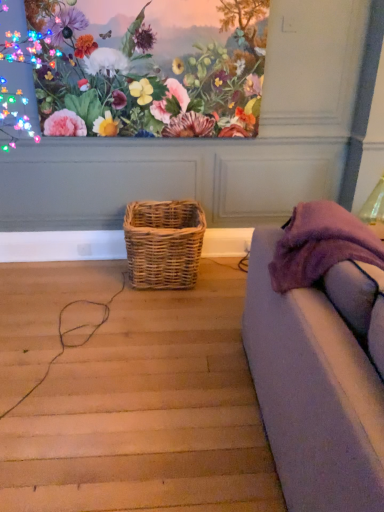
Question: From a real-world perspective, does purple fabric couch at right sit lower than matte floral painting at upper center?

Choices:
 (A) yes
 (B) no

Answer: (A)

Question: Is matte floral painting at upper center surrounded by purple fabric couch at right?

Choices:
 (A) yes
 (B) no

Answer: (B)

Question: Is purple fabric couch at right bigger than matte floral painting at upper center?

Choices:
 (A) yes
 (B) no

Answer: (A)

Question: Does purple fabric couch at right come in front of matte floral painting at upper center?

Choices:
 (A) yes
 (B) no

Answer: (A)

Question: Is purple fabric couch at right turned away from matte floral painting at upper center?

Choices:
 (A) no
 (B) yes

Answer: (A)

Question: Is matte floral painting at upper center taller or shorter than woven natural basket at center?

Choices:
 (A) short
 (B) tall

Answer: (B)

Question: In terms of size, does matte floral painting at upper center appear bigger or smaller than woven natural basket at center?

Choices:
 (A) big
 (B) small

Answer: (B)

Question: Is point (221, 96) closer or farther from the camera than point (178, 287)?

Choices:
 (A) closer
 (B) farther

Answer: (A)

Question: Do you think matte floral painting at upper center is within woven natural basket at center, or outside of it?

Choices:
 (A) inside
 (B) outside

Answer: (B)

Question: From the image's perspective, relative to woven natural basket at center, is purple fabric couch at right above or below?

Choices:
 (A) below
 (B) above

Answer: (A)

Question: In terms of height, does purple fabric couch at right look taller or shorter compared to woven natural basket at center?

Choices:
 (A) tall
 (B) short

Answer: (A)

Question: Considering their positions, is purple fabric couch at right located in front of or behind woven natural basket at center?

Choices:
 (A) front
 (B) behind

Answer: (A)

Question: Considering the positions of purple fabric couch at right and woven natural basket at center in the image, is purple fabric couch at right wider or thinner than woven natural basket at center?

Choices:
 (A) thin
 (B) wide

Answer: (B)

Question: Is woven natural basket at center to the left or to the right of matte floral painting at upper center in the image?

Choices:
 (A) left
 (B) right

Answer: (B)

Question: From their relative heights in the image, would you say woven natural basket at center is taller or shorter than matte floral painting at upper center?

Choices:
 (A) tall
 (B) short

Answer: (B)